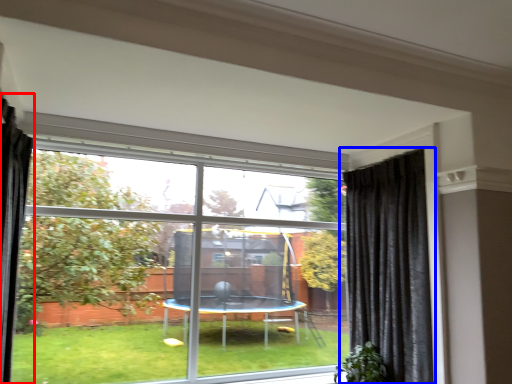
Question: Which object appears farthest to the camera in this image, curtain (highlighted by a red box) or curtain (highlighted by a blue box)?

Choices:
 (A) curtain
 (B) curtain

Answer: (B)